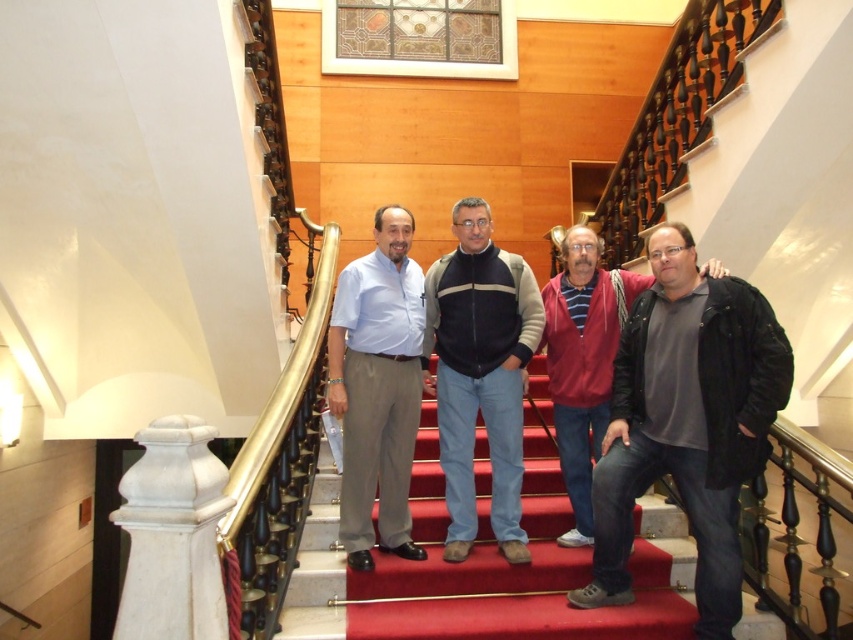
The width and height of the screenshot is (853, 640). What are the coordinates of `red carpet at center` in the screenshot? It's located at (486, 561).

Is point (303, 545) positioned behind point (711, 426)?

Yes, it is.

Find the location of `red carpet at center`. red carpet at center is located at coordinates (486, 561).

This screenshot has width=853, height=640. What do you see at coordinates (486, 561) in the screenshot?
I see `red carpet at center` at bounding box center [486, 561].

Does red carpet at center have a smaller size compared to dark blue and beige jacket at center?

Incorrect, red carpet at center is not smaller in size than dark blue and beige jacket at center.

Describe the element at coordinates (486, 561) in the screenshot. I see `red carpet at center` at that location.

What are the coordinates of `red carpet at center` in the screenshot? It's located at (486, 561).

At what (x,y) coordinates should I click in order to perform the action: click on dark gray matte jacket at center. Please return your answer as a coordinate pair (x, y). This screenshot has height=640, width=853. Looking at the image, I should click on point(688,422).

Who is more distant from viewer, (x=692, y=372) or (x=451, y=362)?

Point (x=451, y=362)

You are a GUI agent. You are given a task and a screenshot of the screen. Output one action in this format:
    pyautogui.click(x=<x>, y=<y>)
    Task: Click on the dark gray matte jacket at center
    The height and width of the screenshot is (640, 853).
    Given the screenshot: What is the action you would take?
    pyautogui.click(x=688, y=422)